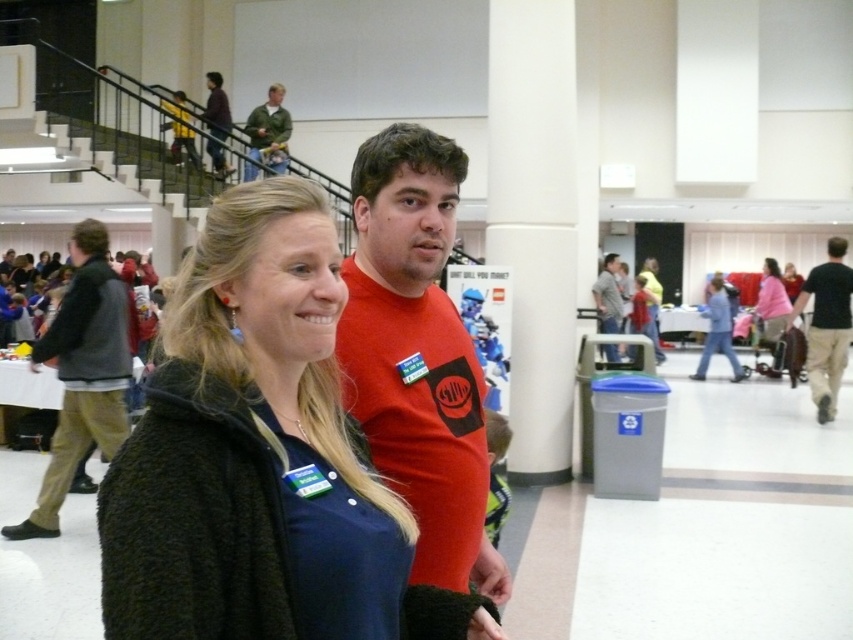
Is dark gray jacket at left thinner than matte red shirt at center?

Correct, dark gray jacket at left's width is less than matte red shirt at center's.

Can you confirm if dark gray jacket at left is positioned to the left of matte red shirt at center?

Indeed, dark gray jacket at left is positioned on the left side of matte red shirt at center.

Between point (4, 531) and point (611, 266), which one is positioned behind?

Point (611, 266)

You are a GUI agent. You are given a task and a screenshot of the screen. Output one action in this format:
    pyautogui.click(x=<x>, y=<y>)
    Task: Click on the dark gray jacket at left
    The height and width of the screenshot is (640, 853).
    Given the screenshot: What is the action you would take?
    pyautogui.click(x=82, y=372)

Does dark gray jacket at left appear on the right side of green matte jacket at upper center?

Indeed, dark gray jacket at left is positioned on the right side of green matte jacket at upper center.

Between point (30, 362) and point (277, 129), which one is positioned in front?

Point (30, 362) is more forward.

Where is `dark gray jacket at left`? The width and height of the screenshot is (853, 640). dark gray jacket at left is located at coordinates click(x=82, y=372).

Is matte red t-shirt at center above matte red shirt at center?

No, matte red t-shirt at center is not above matte red shirt at center.

The height and width of the screenshot is (640, 853). Identify the location of matte red t-shirt at center. (416, 355).

The height and width of the screenshot is (640, 853). What are the coordinates of `matte red t-shirt at center` in the screenshot? It's located at (416, 355).